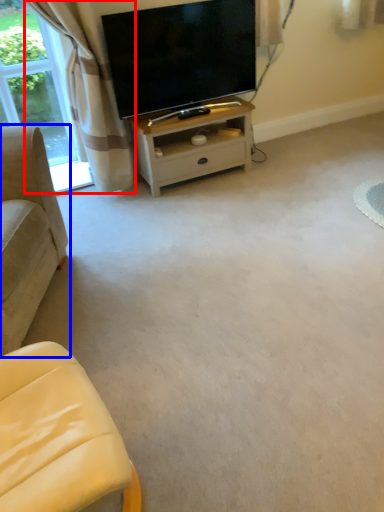
Question: Among these objects, which one is farthest to the camera, curtain (highlighted by a red box) or studio couch (highlighted by a blue box)?

Choices:
 (A) curtain
 (B) studio couch

Answer: (A)